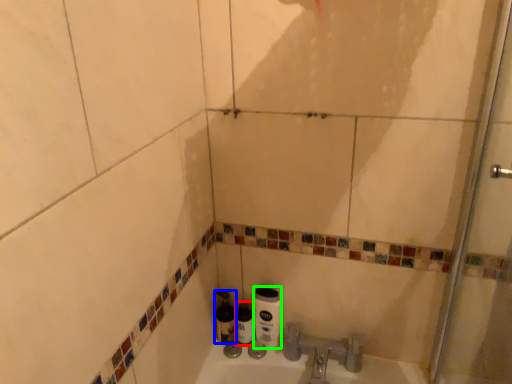
Question: Which is nearer to the bottle (highlighted by a red box)? bottle (highlighted by a blue box) or toilet paper (highlighted by a green box).

Choices:
 (A) bottle
 (B) toilet paper

Answer: (A)